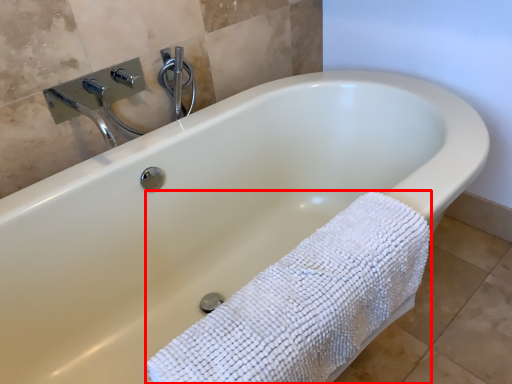
Question: From the image's perspective, where is bath towel (annotated by the red box) located relative to shower?

Choices:
 (A) below
 (B) above

Answer: (A)